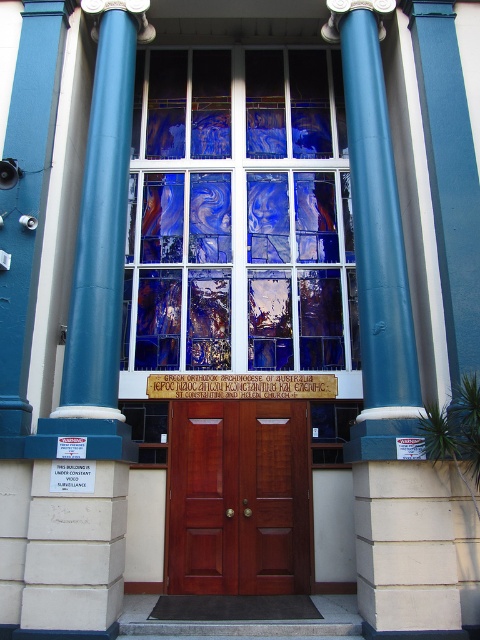
Does teal polished column at center appear on the right side of mahogany wood door at center?

Yes, teal polished column at center is to the right of mahogany wood door at center.

Does teal polished column at center lie in front of mahogany wood door at center?

Yes, teal polished column at center is closer to the viewer.

Which is in front, point (459, 609) or point (305, 408)?

Point (459, 609) is more forward.

Where is `teal polished column at center`? The width and height of the screenshot is (480, 640). teal polished column at center is located at coordinates (388, 372).

Does blue stained glass at center come behind smooth blue column at left?

Yes, blue stained glass at center is further from the viewer.

Is point (338, 179) less distant than point (88, 241)?

That is False.

Locate an element on the screen. This screenshot has width=480, height=640. blue stained glass at center is located at coordinates (240, 212).

Is point (124, 204) positioned behind point (409, 524)?

Yes, point (124, 204) is behind point (409, 524).

Can you confirm if smooth blue column at left is positioned to the left of teal polished column at center?

Correct, you'll find smooth blue column at left to the left of teal polished column at center.

Image resolution: width=480 pixels, height=640 pixels. Describe the element at coordinates (90, 372) in the screenshot. I see `smooth blue column at left` at that location.

Locate an element on the screen. The width and height of the screenshot is (480, 640). smooth blue column at left is located at coordinates (90, 372).